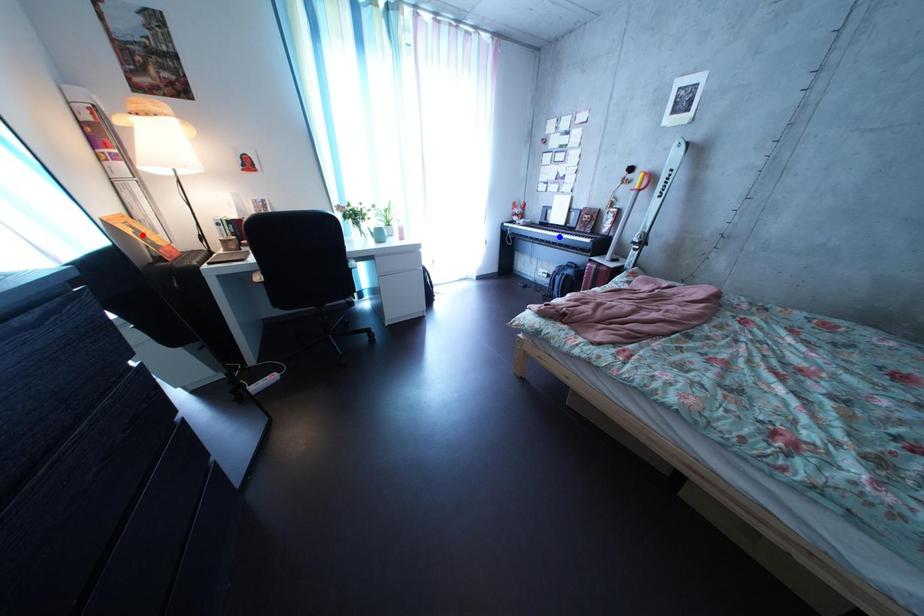
Question: Two points are marked on the image. Which point is closer to the camera?

Choices:
 (A) Blue point is closer.
 (B) Red point is closer.

Answer: (B)